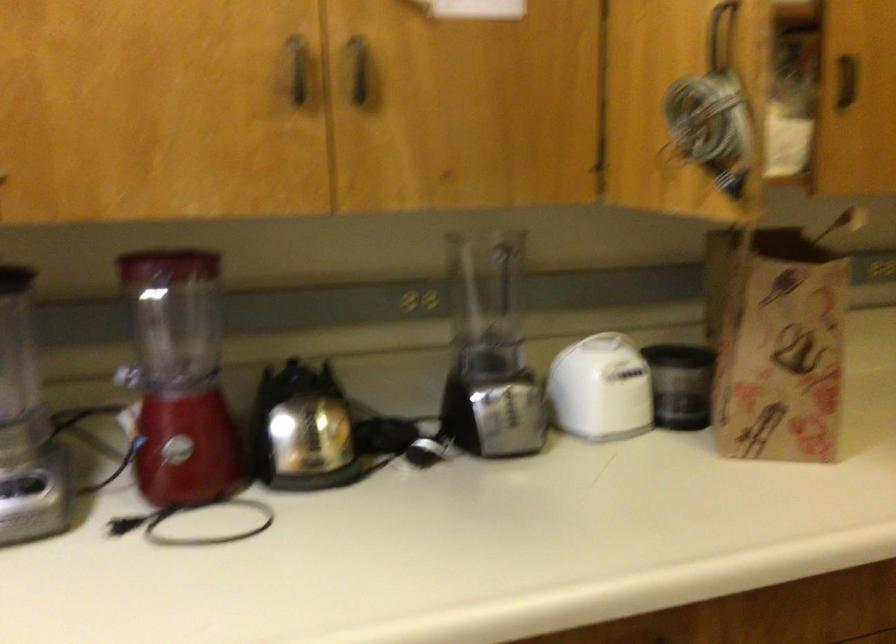
Where is `red blender pitcher`? This screenshot has height=644, width=896. red blender pitcher is located at coordinates click(178, 379).